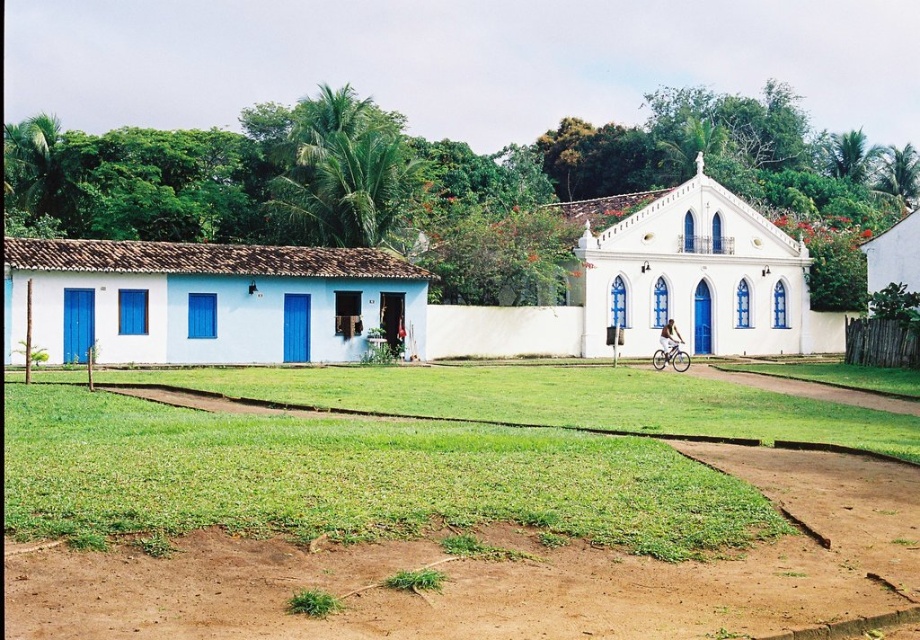
You are standing at the edge of the green grass at center and want to reach the white smooth chapel at center. Which direction should you move in to get there?

To reach the white smooth chapel at center from the green grass at center, you should move upwards since the green grass at center is located below the white smooth chapel at center.

You are planning to install a fence between the green grass at center and the white smooth chapel at center. The fence requires a minimum of 15 meters of space between the two landmarks to be installed properly. Based on the scene, will the fence be able to be installed correctly?

The green grass at center and white smooth chapel at center are 15.14 meters apart, which exceeds the required 15 meters. Therefore, the fence can be installed properly between them.